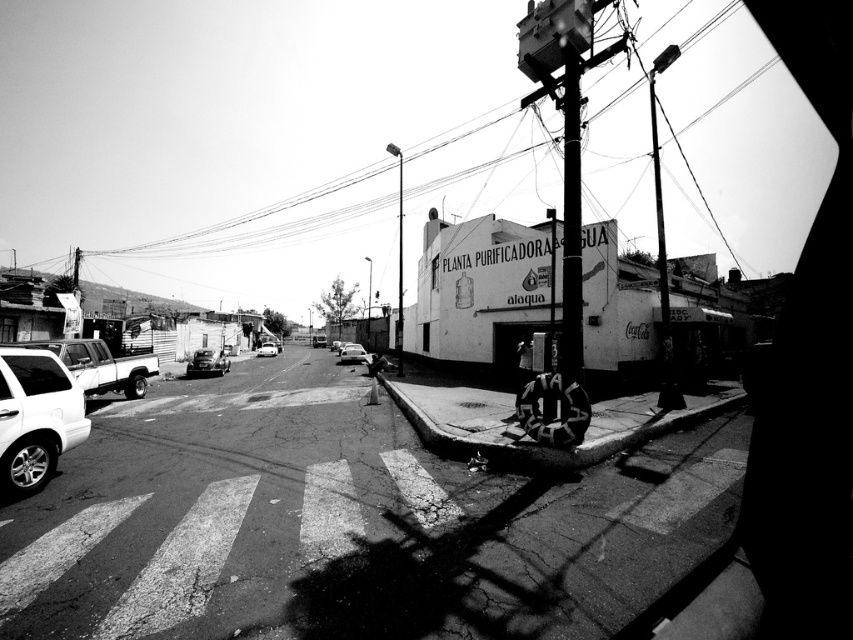
You are standing at the pedestrian crosswalk on the street. You need to place a small traffic cone exactly at the location of the smooth concrete curb at lower center. What are the coordinates where you should place it?

The coordinates for the smooth concrete curb at lower center are at point (550, 449), so you should place the cone there.